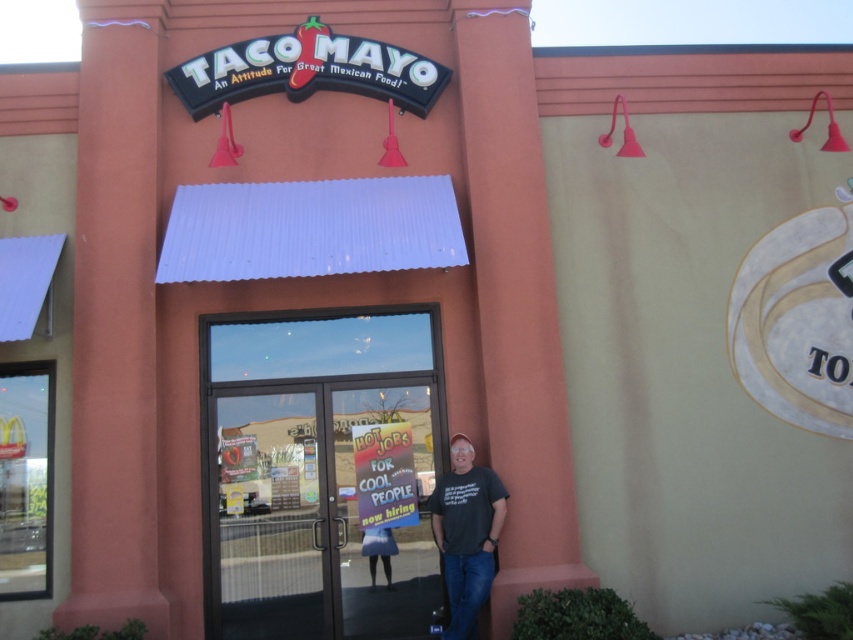
Which is below, transparent glass door at center or dark gray t-shirt at center?

Positioned lower is dark gray t-shirt at center.

The image size is (853, 640). Find the location of `transparent glass door at center`. transparent glass door at center is located at coordinates (322, 474).

You are a GUI agent. You are given a task and a screenshot of the screen. Output one action in this format:
    pyautogui.click(x=<x>, y=<y>)
    Task: Click on the transparent glass door at center
    The height and width of the screenshot is (640, 853).
    Given the screenshot: What is the action you would take?
    pyautogui.click(x=322, y=474)